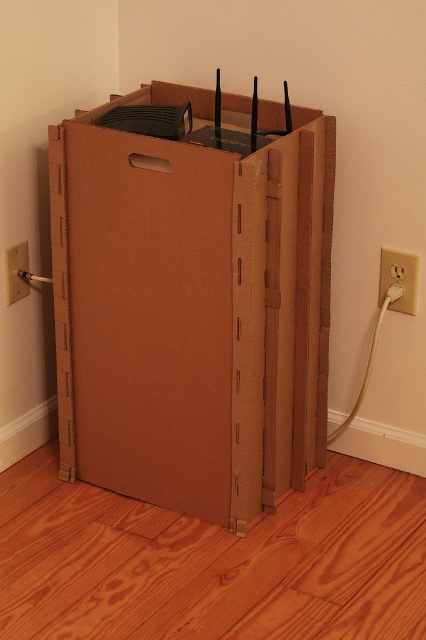
You are setting up a new device and need to plug it into an outlet. You see two outlets labeled white plastic outlet at lower right and white plastic electric outlet at lower right. Which one is wider?

The white plastic outlet at lower right is wider than the white plastic electric outlet at lower right.

You are setting up a new router inside the brown cardboard box at center. You need to plug it into the white plastic outlet at lower right. Based on their positions, will you have to bend down to reach the outlet?

The brown cardboard box at center is located below the white plastic outlet at lower right, so you will not need to bend down. The outlet is higher up, so you can reach it comfortably without bending.